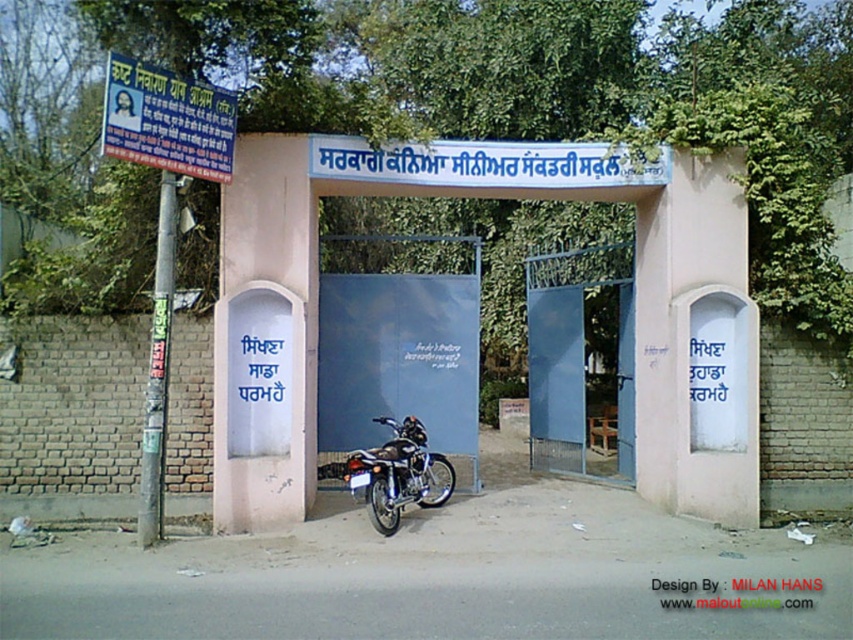
You are a delivery person trying to enter the building through the gate. You have a package that requires you to pass under the shiny metallic motorcycle at center. Can you estimate whether the blue plastic signboard at left is wider than the motorcycle to ensure your package can pass through?

The blue plastic signboard at left might be wider than shiny metallic motorcycle at center, so there is a possibility that the package can pass through. However, it is uncertain and you should check the exact measurements before proceeding.

You are a delivery person approaching the entrance gate. You need to read the blue plastic signboard at left to confirm the address. Can you read it clearly from your current position?

The blue plastic signboard at left is 7.78 meters away from camera. Since it is a standard signboard, you should be able to read it clearly from that distance.